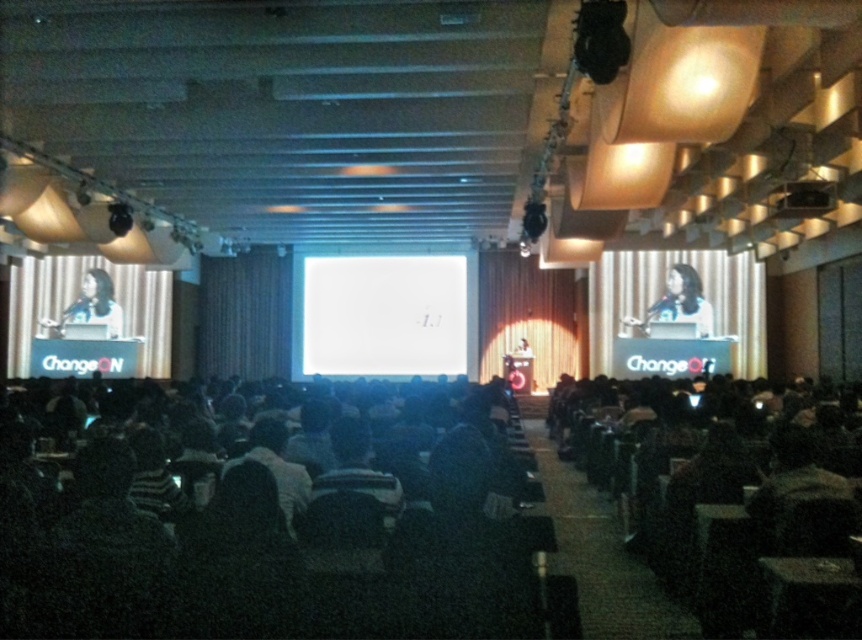
Does matte black laptop at right have a lesser width compared to black plastic projector at upper right?

In fact, matte black laptop at right might be wider than black plastic projector at upper right.

Which is more to the right, matte black laptop at right or black plastic projector at upper right?

matte black laptop at right is more to the right.

Who is more distant from viewer, (660,310) or (804,202)?

The point (660,310) is behind.

This screenshot has height=640, width=862. Find the location of `matte black laptop at right`. matte black laptop at right is located at coordinates (678, 304).

Is matte black laptop at left to the right of black plastic projector at upper right from the viewer's perspective?

Incorrect, matte black laptop at left is not on the right side of black plastic projector at upper right.

Between matte black laptop at left and black plastic projector at upper right, which one has more height?

matte black laptop at left is taller.

The image size is (862, 640). What do you see at coordinates (91, 307) in the screenshot?
I see `matte black laptop at left` at bounding box center [91, 307].

This screenshot has height=640, width=862. Identify the location of matte black laptop at left. pos(91,307).

Who is positioned more to the left, matte black laptop at right or matte black laptop at left?

matte black laptop at left

Describe the element at coordinates (678, 304) in the screenshot. I see `matte black laptop at right` at that location.

You are a GUI agent. You are given a task and a screenshot of the screen. Output one action in this format:
    pyautogui.click(x=<x>, y=<y>)
    Task: Click on the matte black laptop at right
    This screenshot has width=862, height=640.
    Given the screenshot: What is the action you would take?
    pyautogui.click(x=678, y=304)